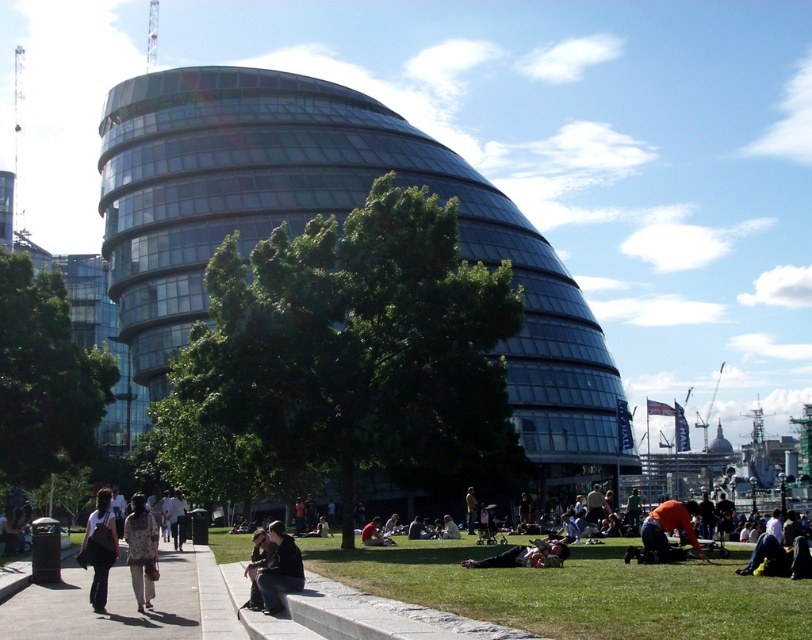
You are planning to place a 2.5 meter wide bench on the concrete sidewalk at lower left and the orange fabric at lower right. Based on their widths, which location would be more suitable for the bench?

The concrete sidewalk at lower left has a greater width than the orange fabric at lower right, so the bench would fit better on the concrete sidewalk at lower left.

You are planning to set up a small picnic blanket on the green grass at lower center. However, there is a person wearing a floral fabric dress at lower center nearby. Can you fit the picnic blanket there without overlapping the dress?

The green grass at lower center is bigger than the floral fabric dress at lower center, so yes, you can fit the picnic blanket there without overlapping the dress.

You are standing at the point with coordinates (x=577, y=589) in the image. What object is located at your current position?

The green grass at lower center is located at point (x=577, y=589).